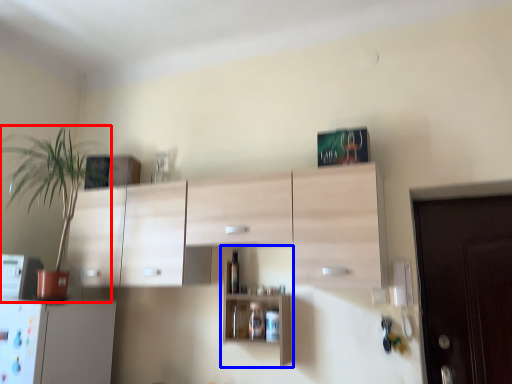
Question: Which of the following is the closest to the observer, houseplant (highlighted by a red box) or shelf (highlighted by a blue box)?

Choices:
 (A) houseplant
 (B) shelf

Answer: (A)